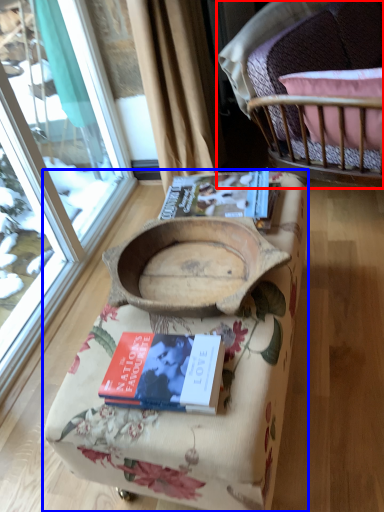
Question: Which of the following is the farthest to the observer, chair (highlighted by a red box) or furniture (highlighted by a blue box)?

Choices:
 (A) chair
 (B) furniture

Answer: (A)